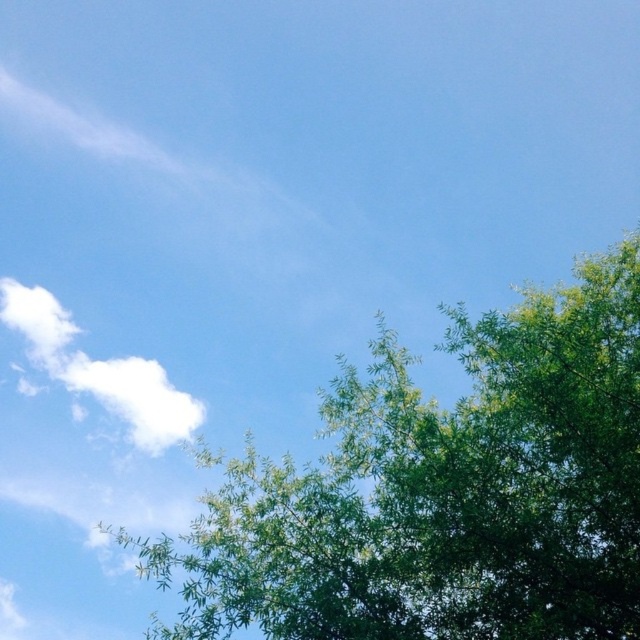
You are an artist trying to sketch this scene. You want to ensure the green leafy tree at upper center and the white fluffy cloud at upper left are proportionally accurate. Which object should you draw wider?

The green leafy tree at upper center should be drawn wider because its width is larger than the white fluffy cloud at upper left according to the description.

You are standing in the middle of the image and want to look at the green leafy tree at upper center. In which direction should you move your gaze to locate it?

The green leafy tree at upper center is located at point coordinates of 0.769 on the x axis and 0.692 on the y axis. To locate it, you should move your gaze to the upper right direction since the x coordinate is greater than 0.5 and the y coordinate is less than 0.5.